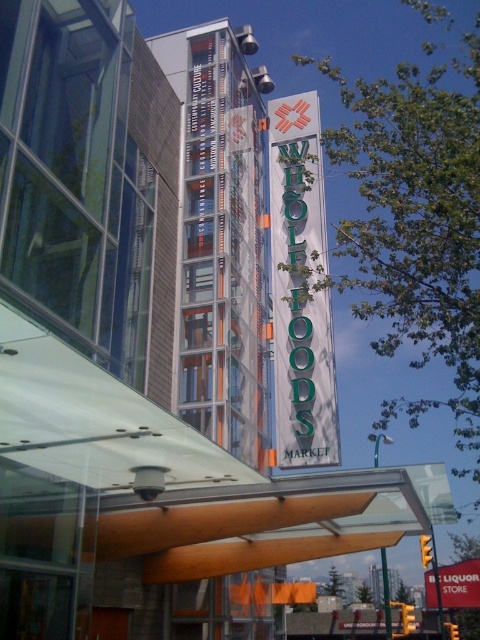
Question: Is green matte sign at upper center above red plastic sign at upper center?

Choices:
 (A) no
 (B) yes

Answer: (B)

Question: Can you confirm if green matte sign at upper center is wider than red plastic sign at upper center?

Choices:
 (A) yes
 (B) no

Answer: (A)

Question: Which point is farther to the camera?

Choices:
 (A) (300, 412)
 (B) (472, 563)

Answer: (B)

Question: Can you confirm if green matte sign at upper center is positioned above red plastic sign at upper center?

Choices:
 (A) yes
 (B) no

Answer: (A)

Question: Among these points, which one is farthest from the camera?

Choices:
 (A) (430, 579)
 (B) (292, 392)

Answer: (A)

Question: Which of the following is the farthest from the observer?

Choices:
 (A) (304, 404)
 (B) (456, 573)

Answer: (B)